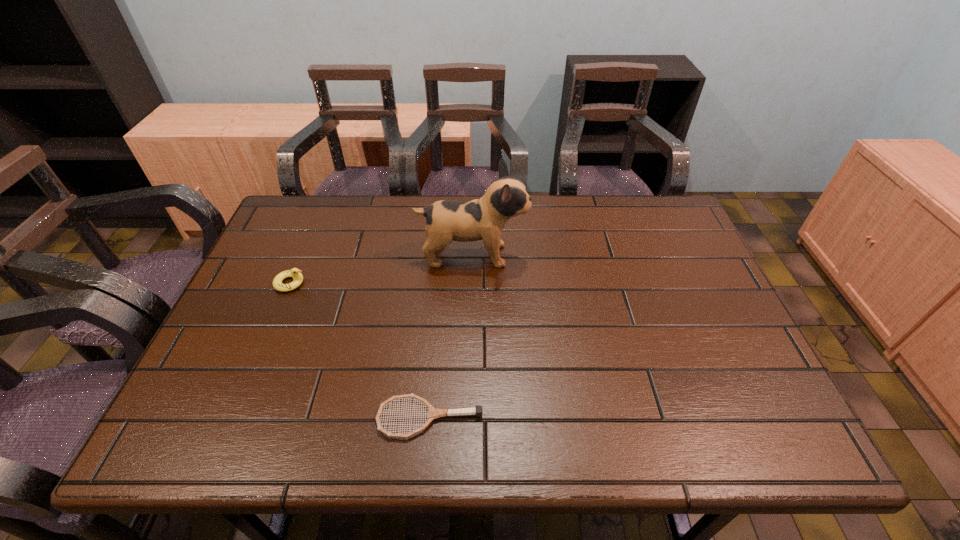
Find the location of a particular element. Image resolution: width=960 pixels, height=540 pixels. object that is positioned at the near edge is located at coordinates (433, 413).

Where is `object that is at the left edge`? object that is at the left edge is located at coordinates (295, 273).

In order to click on blank space at the far edge of the desktop in this screenshot , I will do click(581, 200).

The height and width of the screenshot is (540, 960). Find the location of `vacant space at the left edge`. vacant space at the left edge is located at coordinates (276, 350).

Where is `vacant space at the right edge`? This screenshot has width=960, height=540. vacant space at the right edge is located at coordinates (719, 347).

The width and height of the screenshot is (960, 540). What are the coordinates of `blank space at the far left corner of the desktop` in the screenshot? It's located at (324, 238).

Find the location of a particular element. The width and height of the screenshot is (960, 540). free region at the near left corner is located at coordinates point(176,440).

At what (x,y) coordinates should I click in order to perform the action: click on vacant space at the far right corner of the desktop. Please return your answer as a coordinate pair (x, y). The height and width of the screenshot is (540, 960). Looking at the image, I should click on tap(683, 239).

This screenshot has width=960, height=540. In order to click on unoccupied position between the puppy and the second tallest object in this screenshot , I will do (x=381, y=269).

Identify the location of vacant area that lies between the tennis racket and the second tallest object. (360, 350).